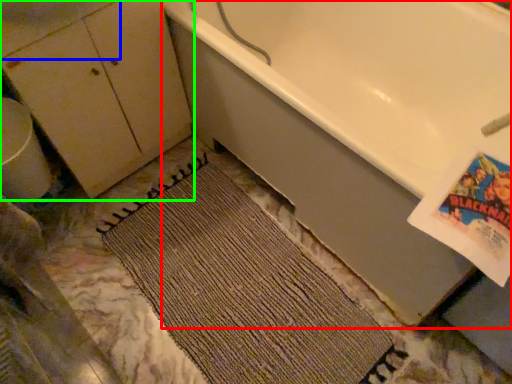
Question: Which is nearer to the bathtub (highlighted by a red box)? sink (highlighted by a blue box) or dresser (highlighted by a green box).

Choices:
 (A) sink
 (B) dresser

Answer: (B)